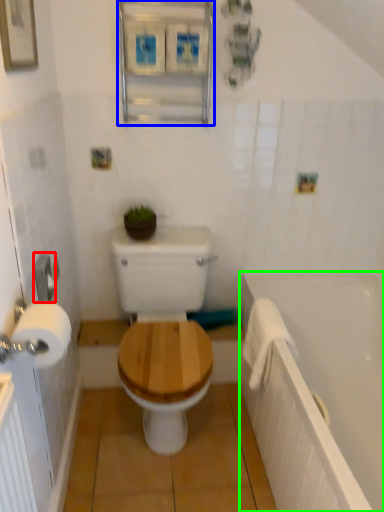
Question: Estimate the real-world distances between objects in this image. Which object is closer to towel bar (highlighted by a red box), medicine cabinet (highlighted by a blue box) or bath (highlighted by a green box)?

Choices:
 (A) medicine cabinet
 (B) bath

Answer: (A)